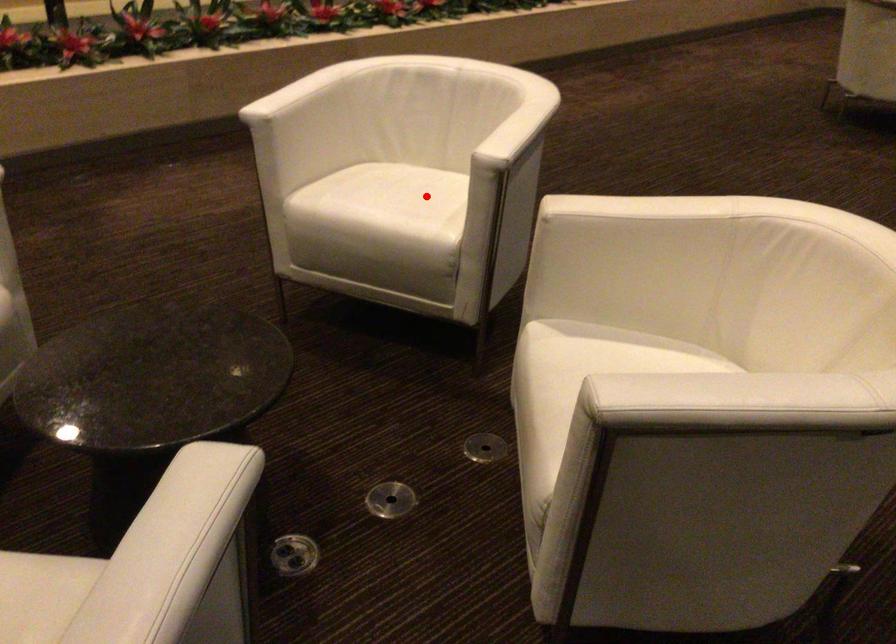
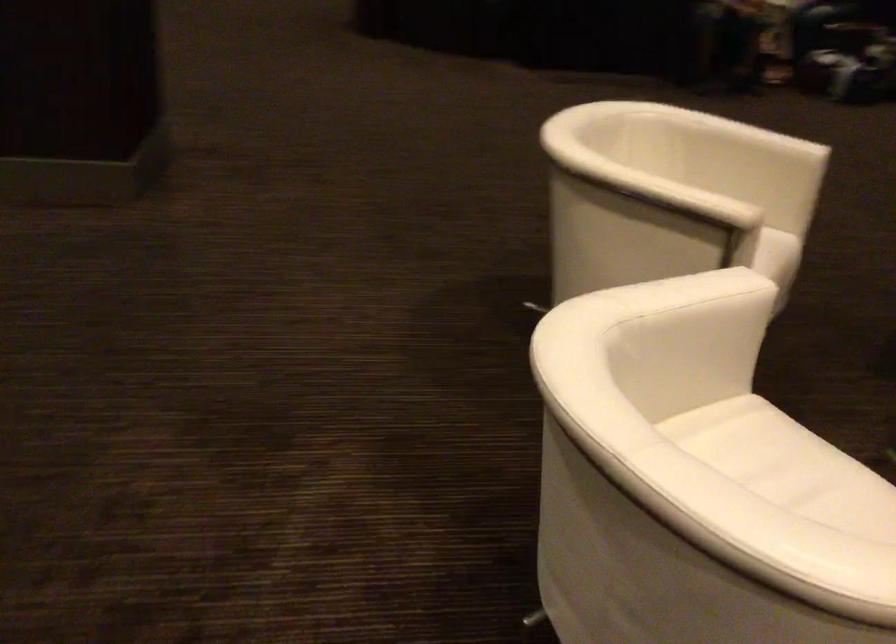
Question: A red point is marked in image1. In image2, is the corresponding 3D point closer to the camera or farther? Reply with the corresponding letter.

Choices:
 (A) The corresponding 3D point is closer.
 (B) The corresponding 3D point is farther.

Answer: (A)